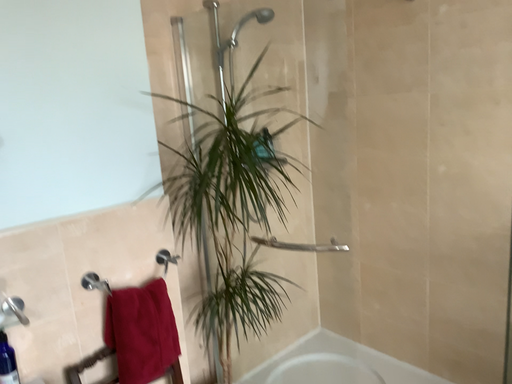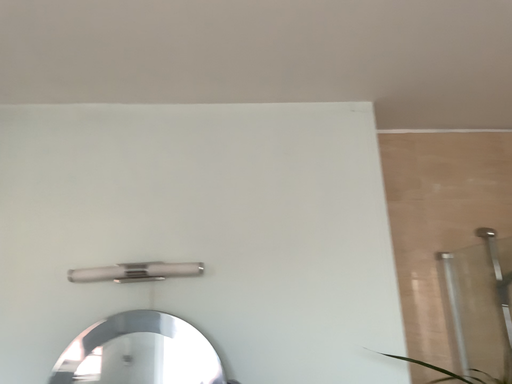
Question: Which way did the camera rotate in the video?

Choices:
 (A) rotated right
 (B) rotated left

Answer: (B)